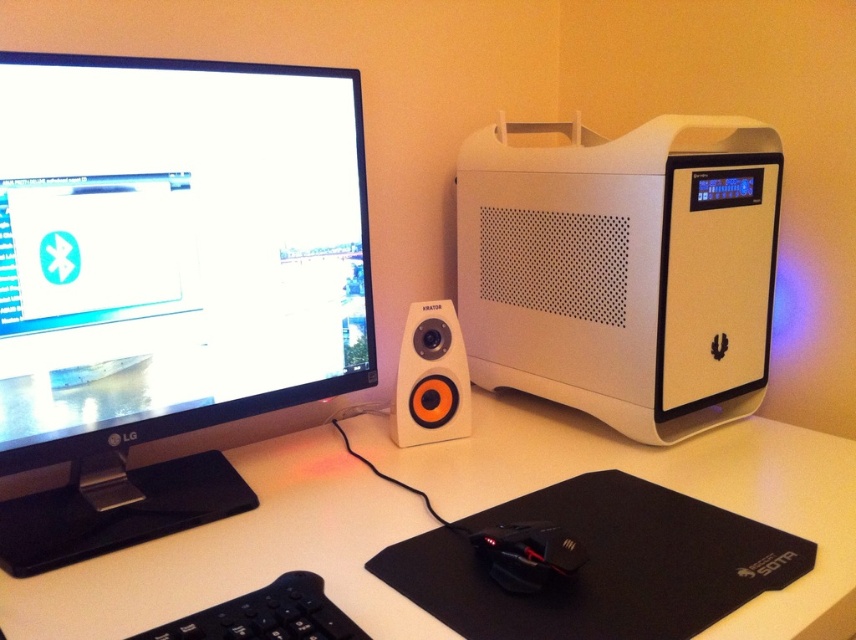
Question: Which point is farther from the camera taking this photo?

Choices:
 (A) (88, 522)
 (B) (580, 364)
 (C) (183, 621)
 (D) (321, 460)

Answer: (B)

Question: Which of the following is the closest to the observer?

Choices:
 (A) (403, 419)
 (B) (408, 472)
 (C) (645, 428)
 (D) (306, 604)

Answer: (D)

Question: Considering the relative positions of white matte computer desk at center and white matte speaker at center in the image provided, where is white matte computer desk at center located with respect to white matte speaker at center?

Choices:
 (A) below
 (B) above

Answer: (A)

Question: Is white matte computer tower at right above white matte computer desk at center?

Choices:
 (A) no
 (B) yes

Answer: (B)

Question: Does white matte speaker at center have a smaller size compared to black matte keyboard at lower left?

Choices:
 (A) no
 (B) yes

Answer: (A)

Question: Which point is farther from the camera taking this photo?

Choices:
 (A) [275, 588]
 (B) [458, 508]
 (C) [584, 298]

Answer: (C)